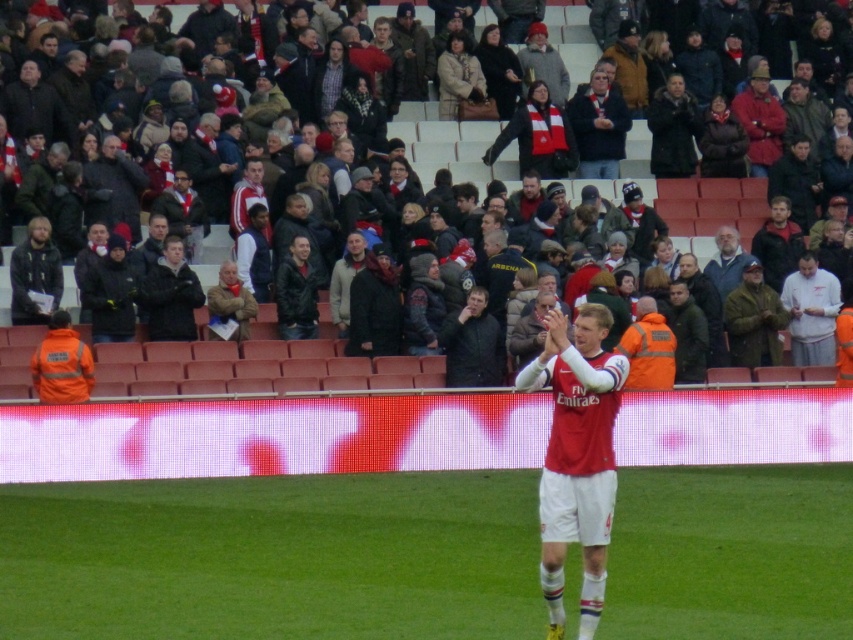
I want to click on dark gray jacket at upper center, so click(x=456, y=150).

Can you confirm if dark gray jacket at upper center is positioned below matte black jacket at left?

Incorrect, dark gray jacket at upper center is not positioned below matte black jacket at left.

What are the coordinates of `dark gray jacket at upper center` in the screenshot? It's located at (456, 150).

Can you confirm if white fabric shirt at right is thinner than matte black jacket at left?

No, white fabric shirt at right is not thinner than matte black jacket at left.

Does white fabric shirt at right have a larger size compared to matte black jacket at left?

Yes, white fabric shirt at right is bigger than matte black jacket at left.

Is point (816, 276) more distant than point (57, 256)?

Yes, point (816, 276) is farther from viewer.

The width and height of the screenshot is (853, 640). I want to click on white fabric shirt at right, so coord(811,310).

From the picture: Does matte red jersey at center have a greater height compared to white fabric shirt at right?

Yes, matte red jersey at center is taller than white fabric shirt at right.

Where is `matte red jersey at center`? matte red jersey at center is located at coordinates (576, 458).

Find the location of a particular element. matte red jersey at center is located at coordinates (576, 458).

Identify the location of matte red jersey at center. Image resolution: width=853 pixels, height=640 pixels. (576, 458).